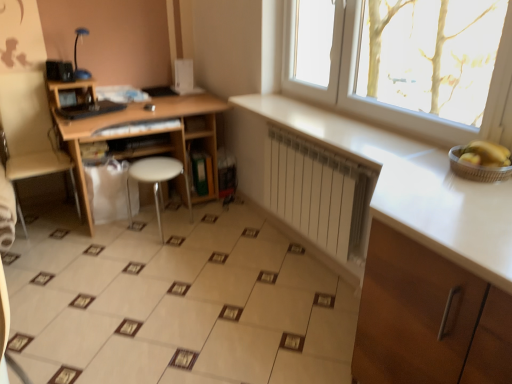
The width and height of the screenshot is (512, 384). Find the location of `vacant space in beige fabric swivel chair at left (from a real-world perspective)`. vacant space in beige fabric swivel chair at left (from a real-world perspective) is located at coordinates (49, 216).